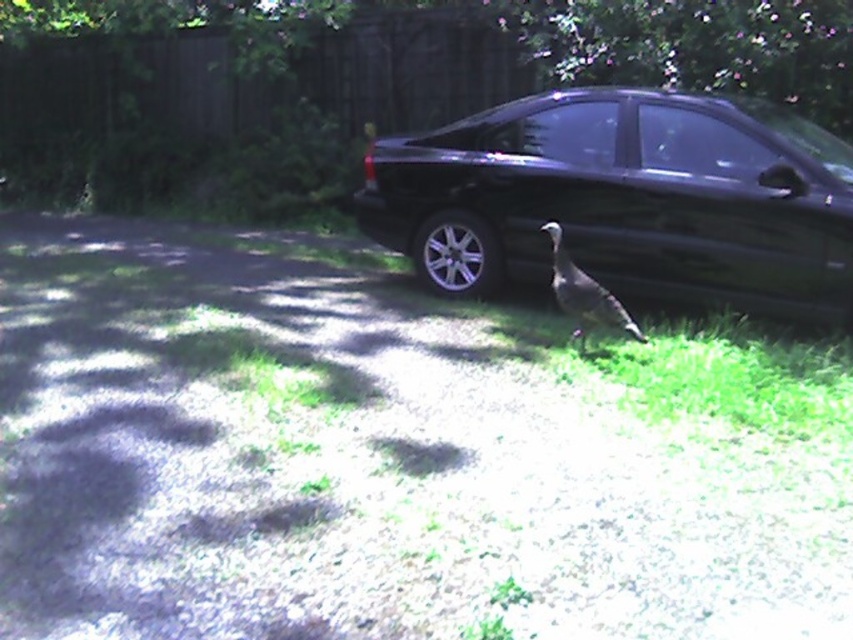
You are a pedestrian standing on the grassy area and want to walk towards the gray feathered bird at center. Will you pass by the black metallic car at center before reaching the bird?

The black metallic car at center is closer to you than the gray feathered bird at center, so you will pass by the black metallic car at center before reaching the bird.

You are standing at point (560, 257) and want to walk to point (524, 196). Which direction should you face to move towards your destination?

To move from point (560, 257) to point (524, 196), you should face towards the direction of the turkey since point (524, 196) is behind point (560, 257).

You are standing at the point labeled as point (654, 173) in the image. You want to walk straight towards the car parked on the driveway. How far will you have to walk to reach the car?

The distance between the point labeled as point (654, 173) and the car parked on the driveway is 2.64 meters, so you will have to walk 2.64 meters to reach the car.